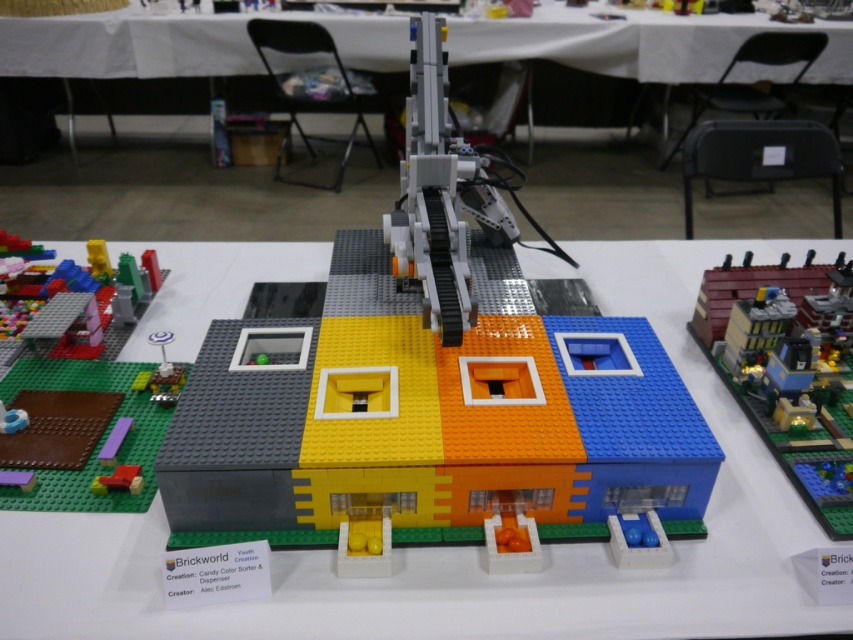
Question: Can you confirm if matte plastic building at center is positioned above brick-colored plastic building at right?

Choices:
 (A) no
 (B) yes

Answer: (A)

Question: Which point appears closest to the camera in this image?

Choices:
 (A) (808, 304)
 (B) (344, 19)

Answer: (A)

Question: Is matte plastic building at center below white plastic table at center?

Choices:
 (A) no
 (B) yes

Answer: (B)

Question: Which point is farther to the camera?

Choices:
 (A) (782, 436)
 (B) (287, 492)
 (C) (625, 273)
 (D) (352, 42)

Answer: (D)

Question: Estimate the real-world distances between objects in this image. Which object is farther from the white plastic table at center?

Choices:
 (A) brick-colored plastic building at center
 (B) matte plastic building at center

Answer: (A)

Question: Is matte plastic building at center smaller than white plastic table at center?

Choices:
 (A) no
 (B) yes

Answer: (A)